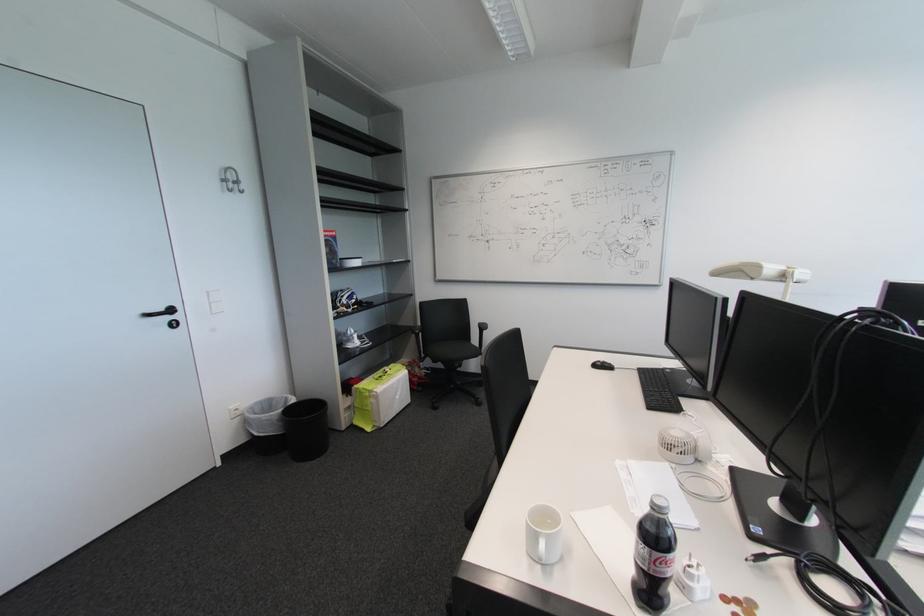
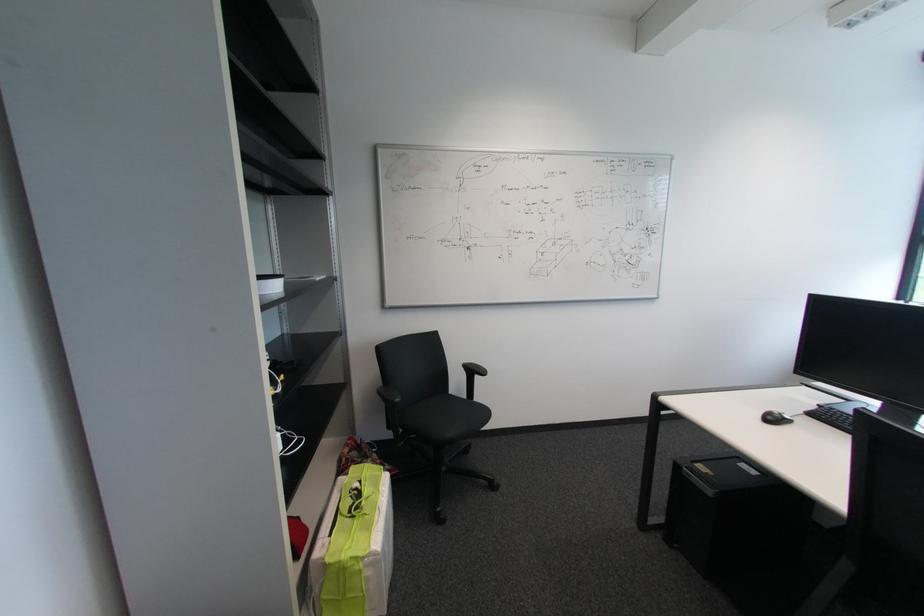
The point at (604,365) is marked in the first image. Where is the corresponding point in the second image?

(775, 418)